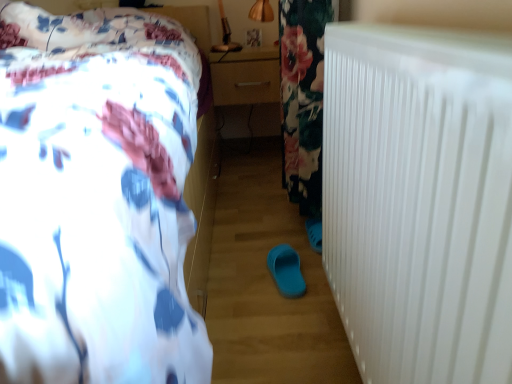
Question: Can you see blue rubber slipper at center touching matte wood drawer at center?

Choices:
 (A) no
 (B) yes

Answer: (A)

Question: Is blue rubber slipper at center positioned beyond the bounds of matte wood drawer at center?

Choices:
 (A) yes
 (B) no

Answer: (A)

Question: Is blue rubber slipper at center at the left side of matte wood drawer at center?

Choices:
 (A) yes
 (B) no

Answer: (B)

Question: Is matte wood drawer at center completely or partially inside blue rubber slipper at center?

Choices:
 (A) yes
 (B) no

Answer: (B)

Question: Can you confirm if blue rubber slipper at center is taller than matte wood drawer at center?

Choices:
 (A) no
 (B) yes

Answer: (A)

Question: Considering their positions, is white plastic radiator at right located in front of or behind blue rubber slipper at center?

Choices:
 (A) behind
 (B) front

Answer: (B)

Question: Looking at their shapes, would you say white plastic radiator at right is wider or thinner than blue rubber slipper at center?

Choices:
 (A) thin
 (B) wide

Answer: (B)

Question: From a real-world perspective, relative to blue rubber slipper at center, is white plastic radiator at right vertically above or below?

Choices:
 (A) below
 (B) above

Answer: (B)

Question: Based on their sizes in the image, would you say white plastic radiator at right is bigger or smaller than blue rubber slipper at center?

Choices:
 (A) small
 (B) big

Answer: (B)

Question: In terms of size, does blue rubber slipper at center appear bigger or smaller than white plastic radiator at right?

Choices:
 (A) big
 (B) small

Answer: (B)

Question: Considering the positions of point (278, 256) and point (499, 355), is point (278, 256) closer or farther from the camera than point (499, 355)?

Choices:
 (A) closer
 (B) farther

Answer: (B)

Question: In terms of width, does blue rubber slipper at center look wider or thinner when compared to white plastic radiator at right?

Choices:
 (A) wide
 (B) thin

Answer: (B)

Question: Is blue rubber slipper at center in front of or behind white plastic radiator at right in the image?

Choices:
 (A) front
 (B) behind

Answer: (B)

Question: Is white floral bedspread at upper left taller or shorter than white plastic radiator at right?

Choices:
 (A) short
 (B) tall

Answer: (B)

Question: Looking at the image, does white floral bedspread at upper left seem bigger or smaller compared to white plastic radiator at right?

Choices:
 (A) big
 (B) small

Answer: (A)